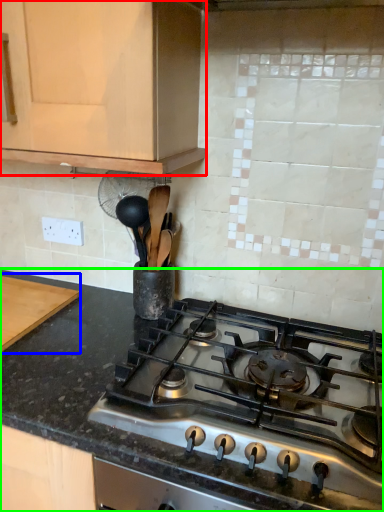
Question: Estimate the real-world distances between objects in this image. Which object is farther from cabinetry (highlighted by a red box), cutting board (highlighted by a blue box) or countertop (highlighted by a green box)?

Choices:
 (A) cutting board
 (B) countertop

Answer: (A)